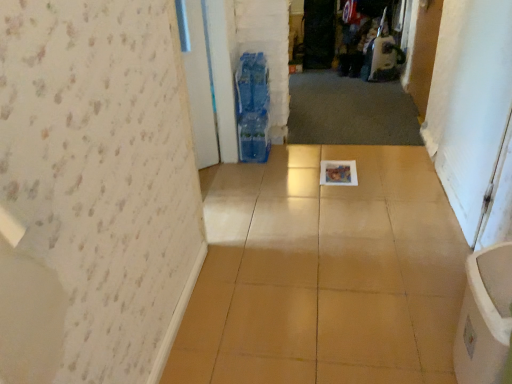
Question: Is transparent plastic screen door at center, the first screen door from the top, spatially inside white glossy screen door at right, positioned as the 1th screen door in bottom-to-top order, or outside of it?

Choices:
 (A) inside
 (B) outside

Answer: (B)

Question: From the image's perspective, is transparent plastic screen door at center, which is counted as the first screen door, starting from the left, above or below white glossy screen door at right, positioned as the 1th screen door in bottom-to-top order?

Choices:
 (A) below
 (B) above

Answer: (B)

Question: Estimate the real-world distances between objects in this image. Which object is farther from the white glossy screen door at right, which appears as the second screen door when viewed from the back?

Choices:
 (A) transparent plastic screen door at center, the first screen door from the top
 (B) wooden door at upper right

Answer: (A)

Question: Based on their relative distances, which object is nearer to the wooden door at upper right?

Choices:
 (A) transparent plastic screen door at center, the first screen door from the top
 (B) white glossy screen door at right, the 2th screen door from the top

Answer: (B)